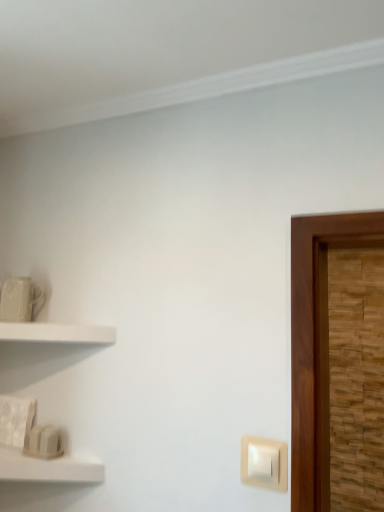
Question: Is white matte shelf at left, which is the second shelf in bottom-to-top order, located outside beige plastic light switch at lower right?

Choices:
 (A) no
 (B) yes

Answer: (B)

Question: Can you confirm if white matte shelf at left, which appears as the first shelf when viewed from the top, is smaller than beige plastic light switch at lower right?

Choices:
 (A) yes
 (B) no

Answer: (B)

Question: Does white matte shelf at left, which appears as the first shelf when viewed from the top, lie behind beige plastic light switch at lower right?

Choices:
 (A) yes
 (B) no

Answer: (A)

Question: Is white matte shelf at left, which is the second shelf in bottom-to-top order, shorter than beige plastic light switch at lower right?

Choices:
 (A) yes
 (B) no

Answer: (A)

Question: Is white matte shelf at left, which appears as the first shelf when viewed from the top, turned away from beige plastic light switch at lower right?

Choices:
 (A) yes
 (B) no

Answer: (B)

Question: Is white matte shelf at lower left, which ranks as the 1th shelf in bottom-to-top order, inside or outside of white matte shelf at left, which appears as the first shelf when viewed from the top?

Choices:
 (A) inside
 (B) outside

Answer: (B)

Question: From a real-world perspective, is white matte shelf at lower left, the 2th shelf in the top-to-bottom sequence, positioned above or below white matte shelf at left, which appears as the first shelf when viewed from the top?

Choices:
 (A) above
 (B) below

Answer: (B)

Question: Is point tap(6, 458) closer or farther from the camera than point tap(105, 344)?

Choices:
 (A) farther
 (B) closer

Answer: (B)

Question: In terms of size, does white matte shelf at lower left, which ranks as the 1th shelf in bottom-to-top order, appear bigger or smaller than white matte shelf at left, which appears as the first shelf when viewed from the top?

Choices:
 (A) small
 (B) big

Answer: (A)

Question: Looking at the image, does white matte shelf at lower left, the 2th shelf in the top-to-bottom sequence, seem bigger or smaller compared to beige plastic light switch at lower right?

Choices:
 (A) small
 (B) big

Answer: (B)

Question: From a real-world perspective, is white matte shelf at lower left, which ranks as the 1th shelf in bottom-to-top order, above or below beige plastic light switch at lower right?

Choices:
 (A) above
 (B) below

Answer: (B)

Question: In terms of height, does white matte shelf at lower left, the 2th shelf in the top-to-bottom sequence, look taller or shorter compared to beige plastic light switch at lower right?

Choices:
 (A) short
 (B) tall

Answer: (A)

Question: Is white matte shelf at lower left, which ranks as the 1th shelf in bottom-to-top order, in front of or behind beige plastic light switch at lower right in the image?

Choices:
 (A) front
 (B) behind

Answer: (A)

Question: Is white matte shelf at left, which appears as the first shelf when viewed from the top, inside the boundaries of beige plastic light switch at lower right, or outside?

Choices:
 (A) inside
 (B) outside

Answer: (B)

Question: Considering the positions of white matte shelf at left, which appears as the first shelf when viewed from the top, and beige plastic light switch at lower right in the image, is white matte shelf at left, which appears as the first shelf when viewed from the top, taller or shorter than beige plastic light switch at lower right?

Choices:
 (A) tall
 (B) short

Answer: (B)